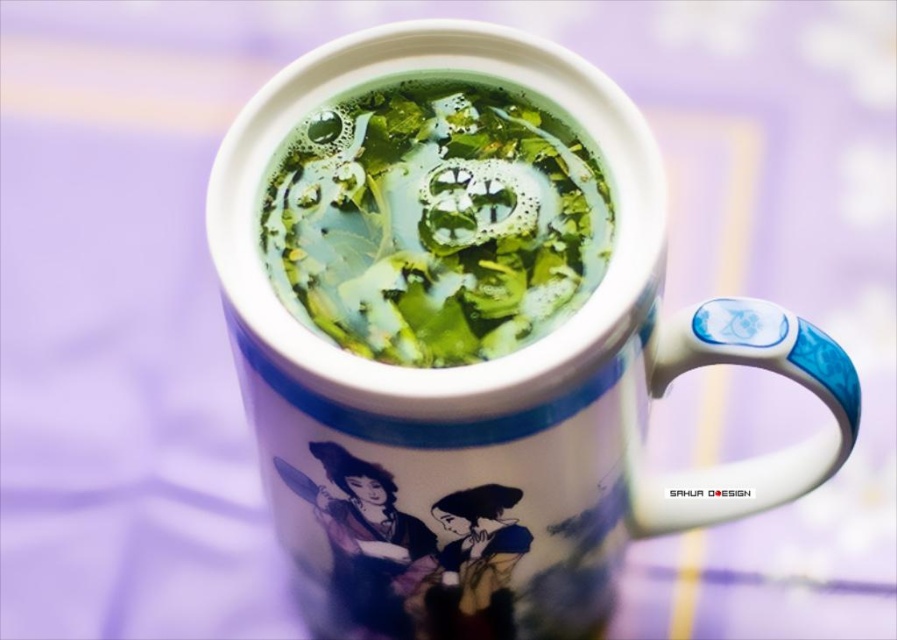
Between white glossy mug at center and green matte tea at center, which one is positioned lower?

white glossy mug at center

Is white glossy mug at center closer to camera compared to green matte tea at center?

Yes, white glossy mug at center is closer to the viewer.

Is point (482, 150) farther from camera compared to point (528, 317)?

Yes.

At what (x,y) coordinates should I click in order to perform the action: click on white glossy mug at center. Please return your answer as a coordinate pair (x, y). Looking at the image, I should click on (475, 337).